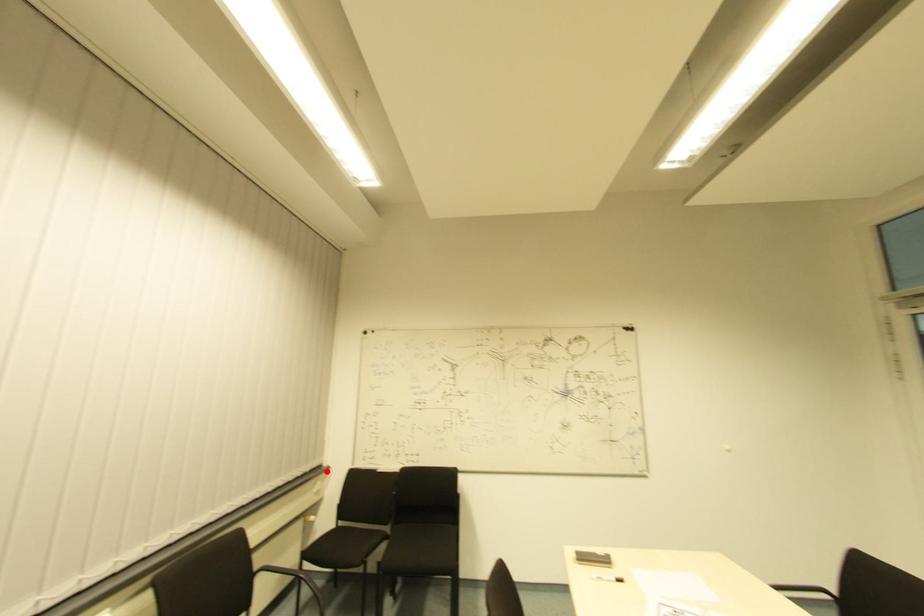
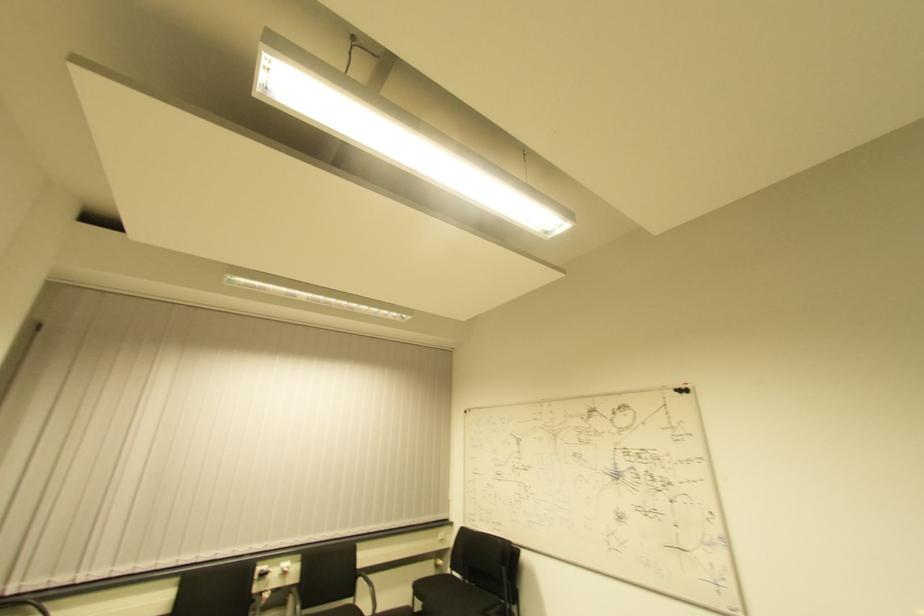
The point at the highlighted location is marked in the first image. Where is the corresponding point in the second image?

(450, 527)